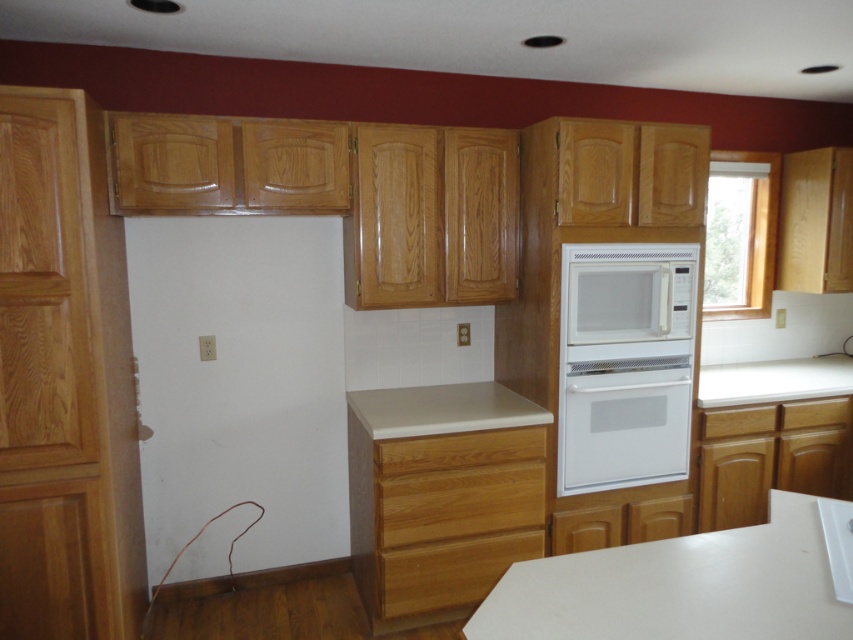
Question: Which point appears closest to the camera in this image?

Choices:
 (A) (509, 540)
 (B) (445, 442)

Answer: (B)

Question: Which point is closer to the camera?

Choices:
 (A) white laminate counter top at lower center
 (B) white glossy oven at center
 (C) wooden drawer at center

Answer: (A)

Question: Does white laminate counter top at lower center have a lesser width compared to wooden drawer at center?

Choices:
 (A) no
 (B) yes

Answer: (A)

Question: Does white laminate counter top at lower center appear under wooden drawer at lower center?

Choices:
 (A) yes
 (B) no

Answer: (B)

Question: Is white glossy sink at lower right in front of wooden drawer at lower right?

Choices:
 (A) no
 (B) yes

Answer: (B)

Question: Which object appears farthest from the camera in this image?

Choices:
 (A) white laminate counter top at lower center
 (B) white glossy sink at lower right

Answer: (B)